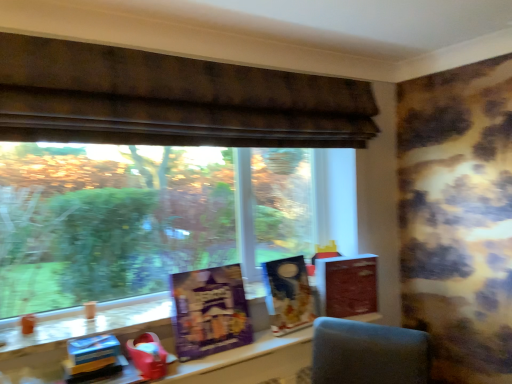
Question: Is matte brown book at right, the first paperback book viewed from the right, positioned behind blue cardboard box at lower left, placed as the 1th toy when sorted from left to right?

Choices:
 (A) no
 (B) yes

Answer: (B)

Question: Is matte brown book at right, the second paperback book from the front, to the right of blue cardboard box at lower left, which ranks as the 2th toy in right-to-left order, from the viewer's perspective?

Choices:
 (A) no
 (B) yes

Answer: (B)

Question: Can you confirm if matte brown book at right, marked as the 2th paperback book in a left-to-right arrangement, is smaller than blue cardboard box at lower left, placed as the 1th toy when sorted from left to right?

Choices:
 (A) yes
 (B) no

Answer: (B)

Question: From the image's perspective, does matte brown book at right, the first paperback book viewed from the right, appear lower than blue cardboard box at lower left, placed as the 1th toy when sorted from left to right?

Choices:
 (A) no
 (B) yes

Answer: (A)

Question: From a real-world perspective, is matte brown book at right, the first paperback book viewed from the right, located beneath blue cardboard box at lower left, placed as the 1th toy when sorted from left to right?

Choices:
 (A) yes
 (B) no

Answer: (B)

Question: Is brown textured fabric at upper center in front of or behind purple matte board game at center, positioned as the second paperback book in right-to-left order, in the image?

Choices:
 (A) front
 (B) behind

Answer: (A)

Question: Considering the positions of point 10,71 and point 187,319, is point 10,71 closer or farther from the camera than point 187,319?

Choices:
 (A) farther
 (B) closer

Answer: (B)

Question: Considering the positions of brown textured fabric at upper center and purple matte board game at center, which ranks as the second paperback book in back-to-front order, in the image, is brown textured fabric at upper center bigger or smaller than purple matte board game at center, which ranks as the second paperback book in back-to-front order,?

Choices:
 (A) small
 (B) big

Answer: (B)

Question: From a real-world perspective, is brown textured fabric at upper center positioned above or below purple matte board game at center, which ranks as the second paperback book in back-to-front order?

Choices:
 (A) below
 (B) above

Answer: (B)

Question: From their relative heights in the image, would you say matte black book at center is taller or shorter than matte brown book at right, the 1th paperback book from the back?

Choices:
 (A) short
 (B) tall

Answer: (B)

Question: Relative to matte brown book at right, the second paperback book from the front, is matte black book at center in front or behind?

Choices:
 (A) behind
 (B) front

Answer: (B)

Question: From a real-world perspective, relative to matte brown book at right, the first paperback book viewed from the right, is matte black book at center vertically above or below?

Choices:
 (A) below
 (B) above

Answer: (B)

Question: Visually, is matte black book at center positioned to the left or to the right of matte brown book at right, marked as the 2th paperback book in a left-to-right arrangement?

Choices:
 (A) right
 (B) left

Answer: (B)

Question: From their relative heights in the image, would you say purple matte board game at center, which appears as the 1th paperback book when viewed from the left, is taller or shorter than brown textured fabric at upper center?

Choices:
 (A) short
 (B) tall

Answer: (B)

Question: Would you say purple matte board game at center, which ranks as the second paperback book in back-to-front order, is to the left or to the right of brown textured fabric at upper center in the picture?

Choices:
 (A) left
 (B) right

Answer: (A)